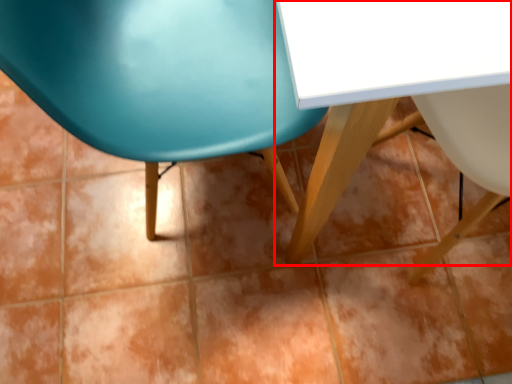
Question: From the image's perspective, where is table (annotated by the red box) located in relation to chair in the image?

Choices:
 (A) above
 (B) below

Answer: (A)